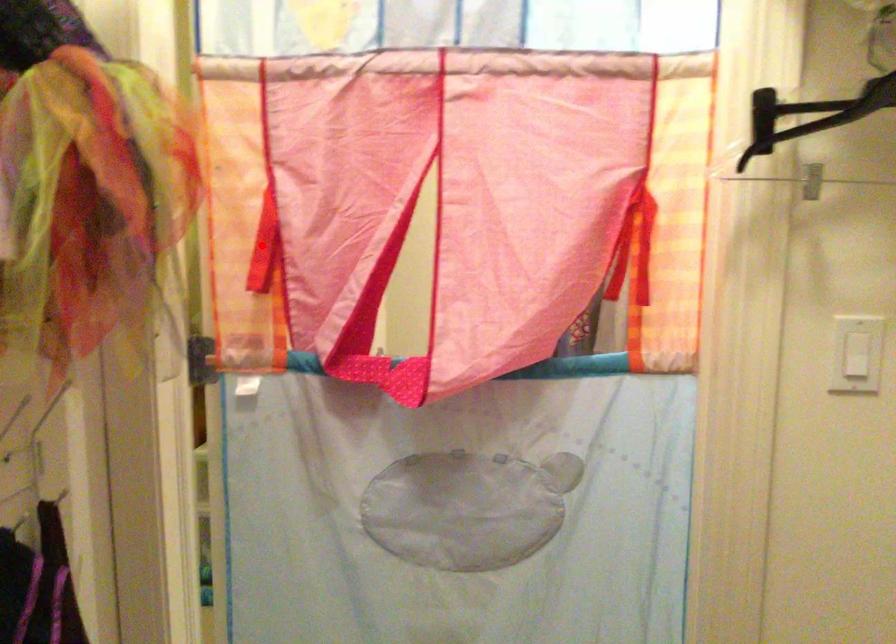
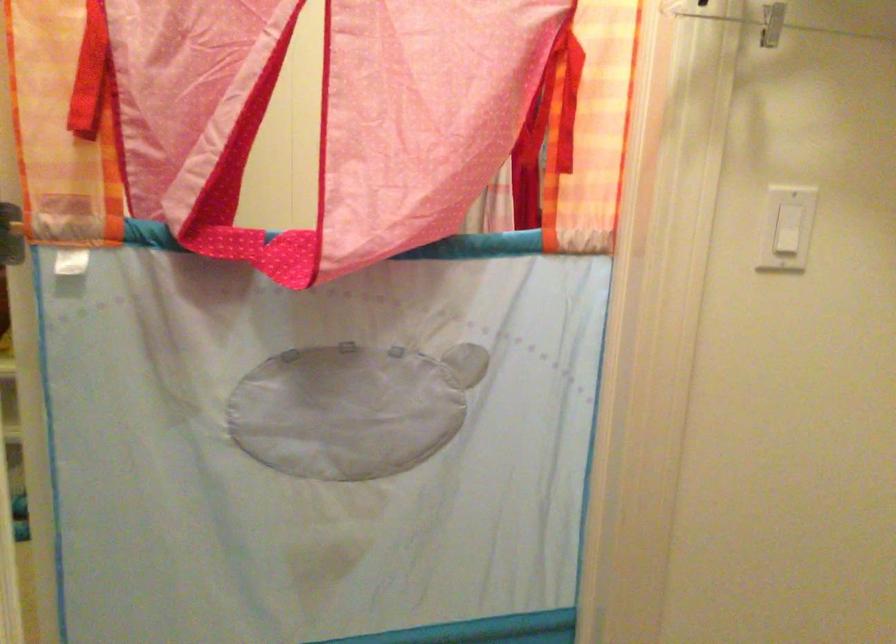
Find the pixel in the second image that matches the highlighted location in the first image.

(90, 73)